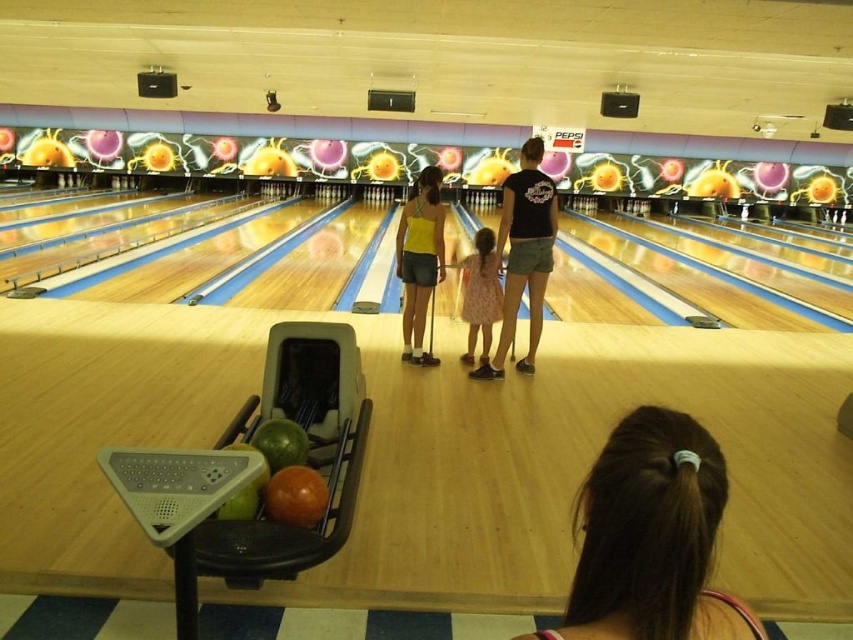
Can you confirm if brown hair at center is thinner than yellow matte tank top at center?

Correct, brown hair at center's width is less than yellow matte tank top at center's.

Is point (618, 424) closer to viewer compared to point (410, 282)?

Yes, point (618, 424) is closer to viewer.

Find the location of `brown hair at center`. brown hair at center is located at coordinates click(651, 536).

Can you confirm if brown hair at center is taller than dress fabric at center?

Incorrect, brown hair at center's height is not larger of dress fabric at center's.

Who is more distant from viewer, (648, 435) or (492, 248)?

Positioned behind is point (492, 248).

Locate an element on the screen. This screenshot has height=640, width=853. brown hair at center is located at coordinates (651, 536).

Can you confirm if yellow matte tank top at center is taller than dress fabric at center?

Yes, yellow matte tank top at center is taller than dress fabric at center.

Locate an element on the screen. The height and width of the screenshot is (640, 853). yellow matte tank top at center is located at coordinates (419, 259).

Which is in front, point (418, 211) or point (471, 282)?

Point (418, 211) is in front.

You are a GUI agent. You are given a task and a screenshot of the screen. Output one action in this format:
    pyautogui.click(x=<x>, y=<y>)
    Task: Click on the yellow matte tank top at center
    This screenshot has height=640, width=853.
    Given the screenshot: What is the action you would take?
    pyautogui.click(x=419, y=259)